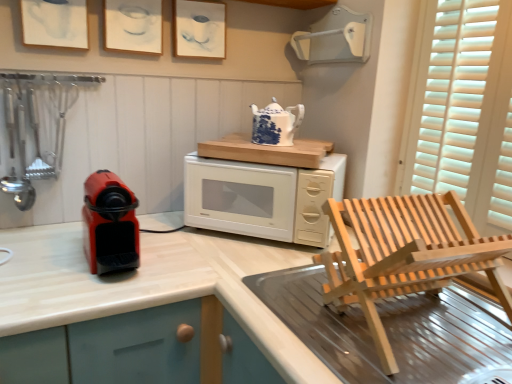
Question: Considering the positions of matte paper picture frame at upper left, the third picture frame from the right, and white paper at upper center, which ranks as the first picture frame in right-to-left order, in the image, is matte paper picture frame at upper left, the third picture frame from the right, wider or thinner than white paper at upper center, which ranks as the first picture frame in right-to-left order,?

Choices:
 (A) thin
 (B) wide

Answer: (B)

Question: From a real-world perspective, is matte paper picture frame at upper left, the third picture frame from the right, positioned above or below white paper at upper center, which appears as the 3th picture frame when viewed from the left?

Choices:
 (A) below
 (B) above

Answer: (B)

Question: Based on their relative distances, which object is nearer to the matte paper picture frame at upper center, the 2th picture frame positioned from the left?

Choices:
 (A) white paper at upper center, which appears as the 3th picture frame when viewed from the left
 (B) matte paper picture frame at upper left, the third picture frame from the right
 (C) matte plastic coffee machine at left
 (D) natural wood chair at lower right
 (E) white glossy microwave oven at center

Answer: (A)

Question: Which is farther from the matte paper picture frame at upper center, which is the second picture frame in right-to-left order?

Choices:
 (A) natural wood chair at lower right
 (B) white paper at upper center, which ranks as the first picture frame in right-to-left order
 (C) white glossy microwave oven at center
 (D) matte paper picture frame at upper left, arranged as the 1th picture frame when viewed from the left
 (E) blue and white ceramic teapot at upper center

Answer: (A)